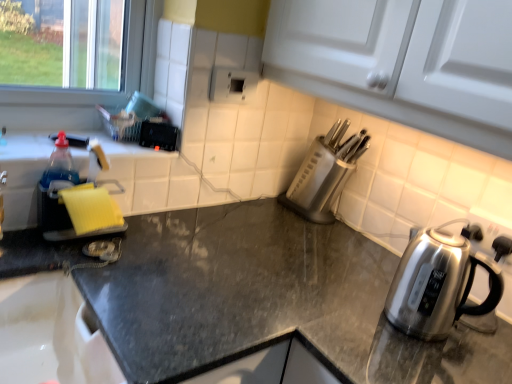
You are a GUI agent. You are given a task and a screenshot of the screen. Output one action in this format:
    pyautogui.click(x=<x>, y=<y>)
    Task: Click on the free space on the front side of satin silver kettle at right
    
    Given the screenshot: What is the action you would take?
    pyautogui.click(x=446, y=366)